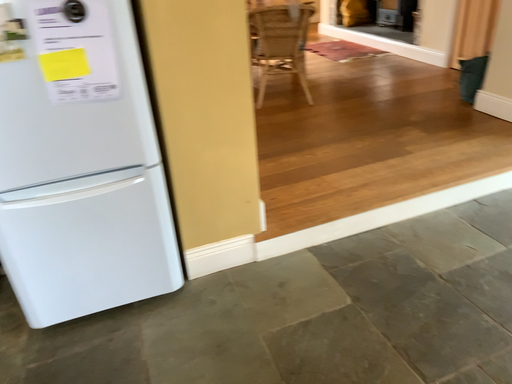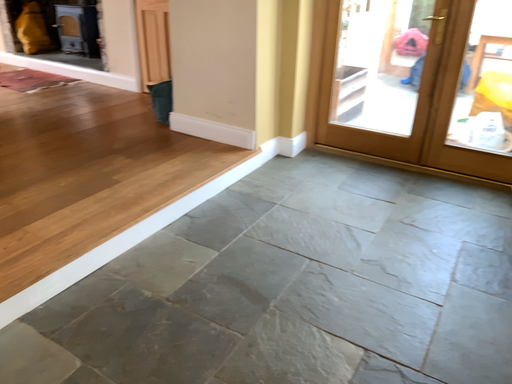
Question: How did the camera likely rotate when shooting the video?

Choices:
 (A) rotated downward
 (B) rotated upward

Answer: (B)